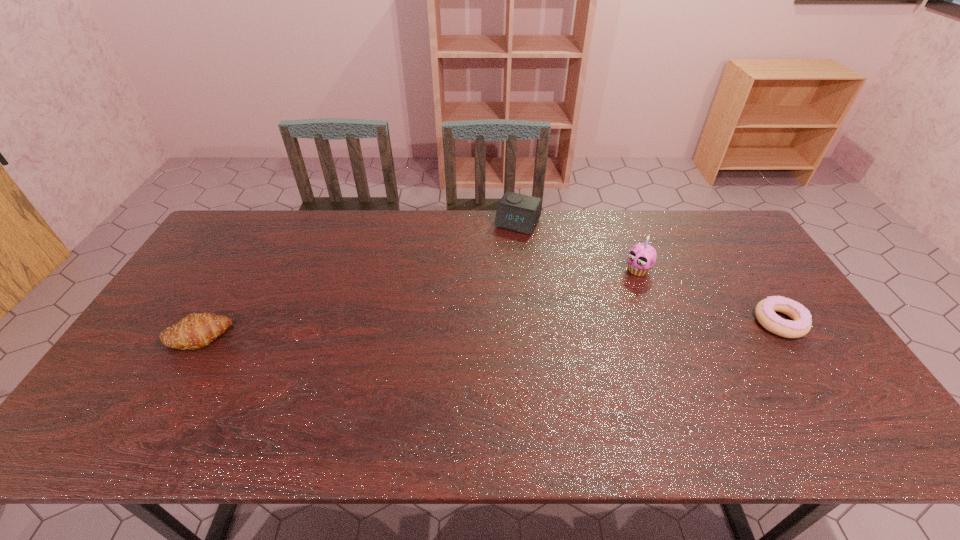
In order to click on free location at the near edge of the desktop in this screenshot , I will do tap(203, 381).

This screenshot has width=960, height=540. I want to click on free region at the left edge of the desktop, so click(x=202, y=310).

The image size is (960, 540). What are the coordinates of `free space at the right edge of the desktop` in the screenshot? It's located at (735, 302).

In the image, there is a desktop. Identify the location of vacant space at the near left corner. This screenshot has width=960, height=540. (131, 403).

The image size is (960, 540). I want to click on vacant region at the far right corner of the desktop, so click(x=748, y=245).

Locate an element on the screen. The height and width of the screenshot is (540, 960). free space between the leftmost object and the third shortest object is located at coordinates (356, 280).

Identify the location of empty location between the crescent roll and the second tallest object. (356, 280).

Locate an element on the screen. This screenshot has height=540, width=960. vacant area that lies between the third shortest object and the crescent roll is located at coordinates (356, 280).

Locate an element on the screen. free spot between the leftmost object and the doughnut is located at coordinates (488, 329).

Where is `empty location between the rightmost object and the second farthest object`? empty location between the rightmost object and the second farthest object is located at coordinates (708, 296).